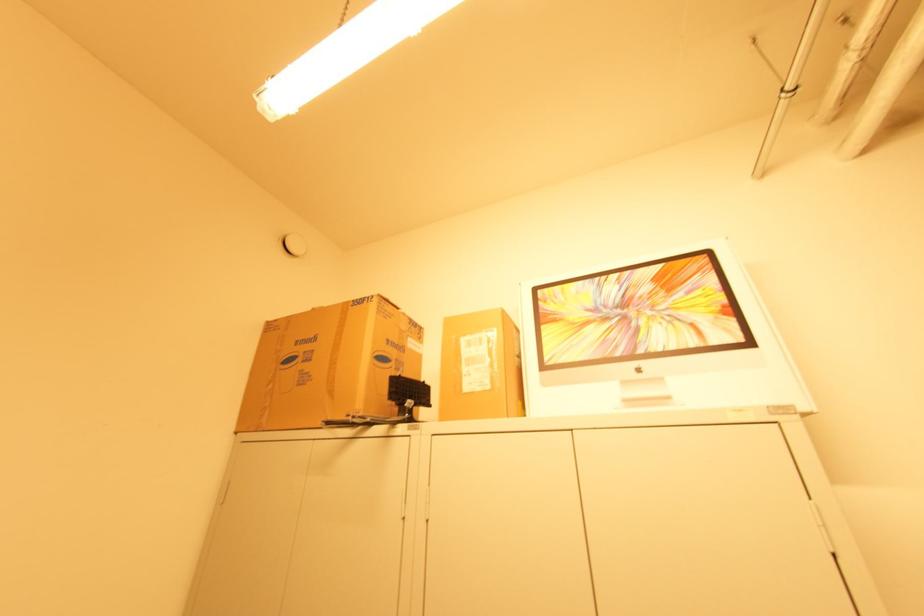
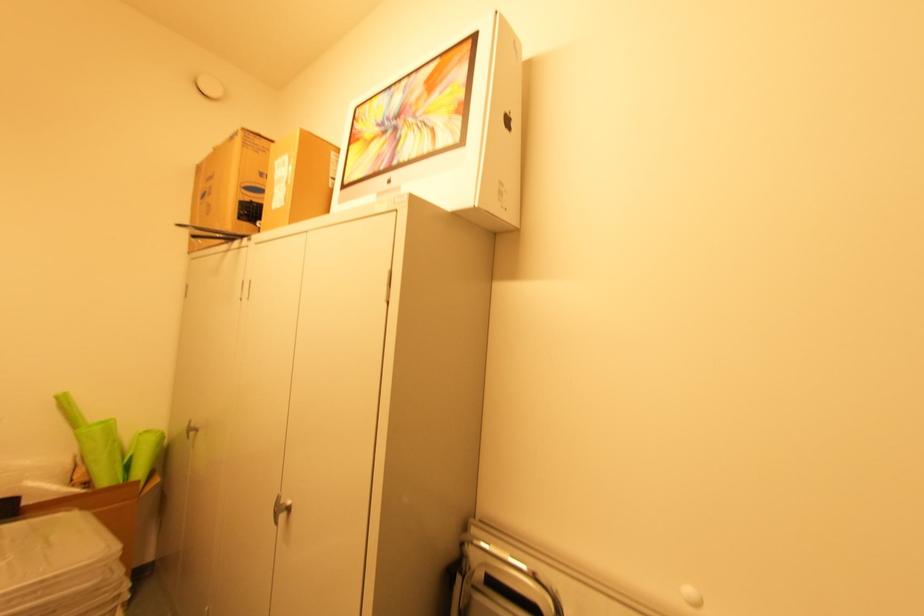
In the second image, find the point that corresponds to pixel 520 359 in the first image.

(334, 180)